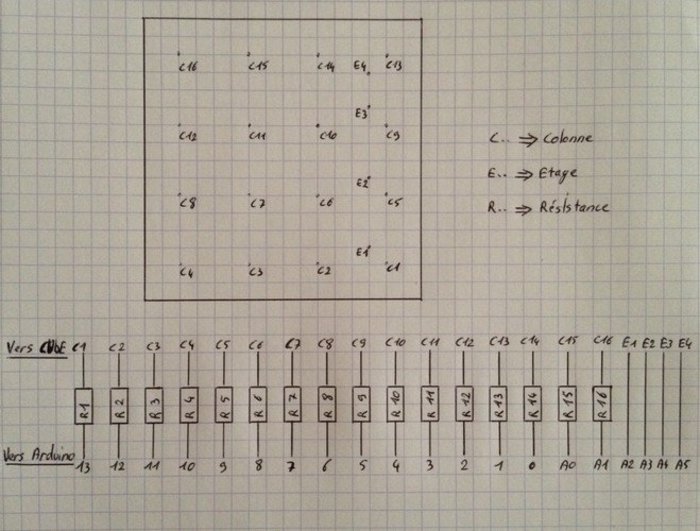
This screenshot has width=700, height=531. I want to click on light, so click(x=684, y=97).